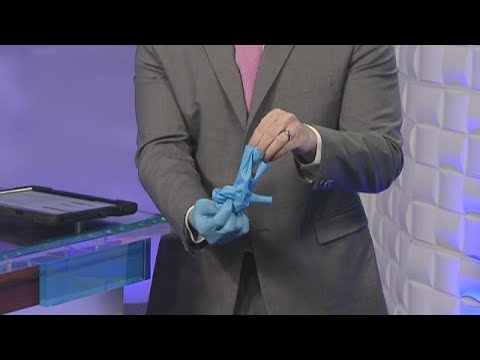
You are a GUI agent. You are given a task and a screenshot of the screen. Output one action in this format:
    pyautogui.click(x=<x>, y=<y>)
    Task: Click on the wall
    
    Given the screenshot: What is the action you would take?
    pyautogui.click(x=424, y=218), pyautogui.click(x=105, y=155)